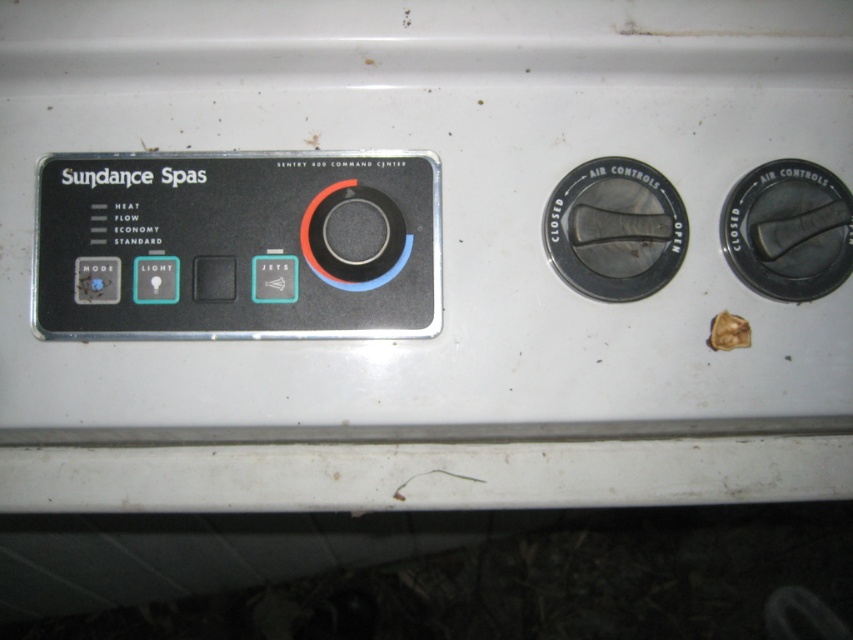
Question: Can you confirm if black plastic air control at right is positioned below black plastic dial at center?

Choices:
 (A) no
 (B) yes

Answer: (A)

Question: Which of the following is the closest to the observer?

Choices:
 (A) (103, 296)
 (B) (669, 184)
 (C) (223, 300)

Answer: (C)

Question: Does black plastic control panel at upper left appear over matte plastic jets at center?

Choices:
 (A) no
 (B) yes

Answer: (B)

Question: Can you confirm if black plastic dial at center is positioned to the left of matte plastic jets at center?

Choices:
 (A) yes
 (B) no

Answer: (B)

Question: Which object is positioned farthest from the matte plastic jets at center?

Choices:
 (A) black plastic air control at right
 (B) matte plastic button at center
 (C) black plastic control panel at upper left

Answer: (A)

Question: Considering the real-world distances, which object is farthest from the matte plastic jets at center?

Choices:
 (A) black plastic dial at center
 (B) matte plastic light at center left
 (C) matte black button at left

Answer: (C)